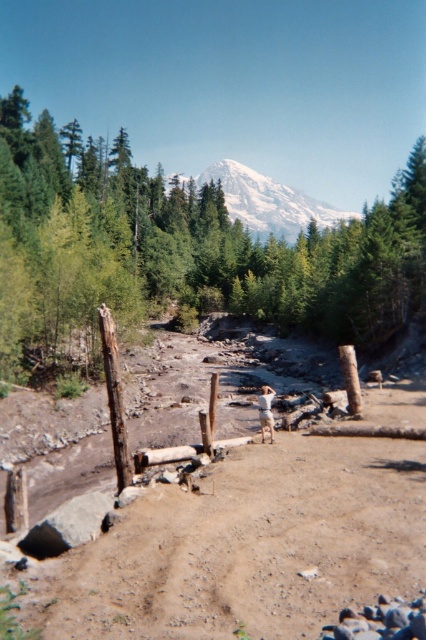
Does brown sandy dirt field at center have a greater height compared to snowy white mountain at center?

No.

In order to click on brown sandy dirt field at center in this screenshot , I will do `click(252, 545)`.

Locate an element on the screen. The height and width of the screenshot is (640, 426). green leafy tree at center is located at coordinates (186, 246).

How far apart are green leafy tree at center and snowy white mountain at center?

green leafy tree at center and snowy white mountain at center are 141.11 meters apart from each other.

Between point (138, 212) and point (270, 216), which one is positioned behind?

Positioned behind is point (270, 216).

At what (x,y) coordinates should I click in order to perform the action: click on green leafy tree at center. Please return your answer as a coordinate pair (x, y). This screenshot has width=426, height=640. Looking at the image, I should click on (186, 246).

Does point (144, 499) come farther from viewer compared to point (43, 172)?

No, it is in front of (43, 172).

Does brown sandy dirt field at center have a lesser height compared to green leafy tree at center?

Indeed, brown sandy dirt field at center has a lesser height compared to green leafy tree at center.

Locate an element on the screen. The height and width of the screenshot is (640, 426). brown sandy dirt field at center is located at coordinates (252, 545).

You are a GUI agent. You are given a task and a screenshot of the screen. Output one action in this format:
    pyautogui.click(x=<x>, y=<y>)
    Task: Click on the brown sandy dirt field at center
    The width and height of the screenshot is (426, 640).
    Given the screenshot: What is the action you would take?
    pyautogui.click(x=252, y=545)